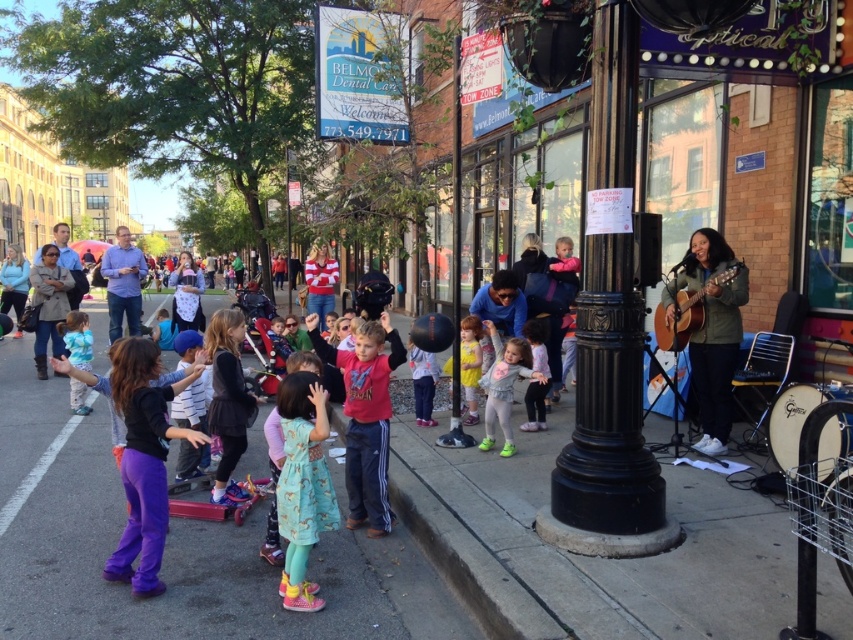
You are a photographer trying to capture a candid shot of the acoustic guitar at right and the matte black shirt at center. Since you want to ensure both are in focus, you need to know which object is shorter. Which one is shorter?

The acoustic guitar at right has a lesser height compared to the matte black shirt at center, so the acoustic guitar at right is shorter.

You are a photographer trying to capture a photo of the light pink fabric dress at center and the purple cotton pants at lower left. Which object should you focus on first if you want to include both in the frame without moving the camera?

The purple cotton pants at lower left is positioned on the left side of light pink fabric dress at center, so you should focus on the purple cotton pants at lower left first to ensure both are in the frame.

Looking at this image, you are a musician carrying an acoustic guitar at right and need to reach the stage located 10 meters from the matte black shirt at center. Can you walk directly to the stage without moving the guitar?

The acoustic guitar at right is 8.58 meters from matte black shirt at center. Since the stage is 10 meters away from the matte black shirt at center, the distance between the acoustic guitar and the stage is approximately 1.42 meters. Therefore, you can walk directly to the stage without moving the guitar as the distance is manageable.